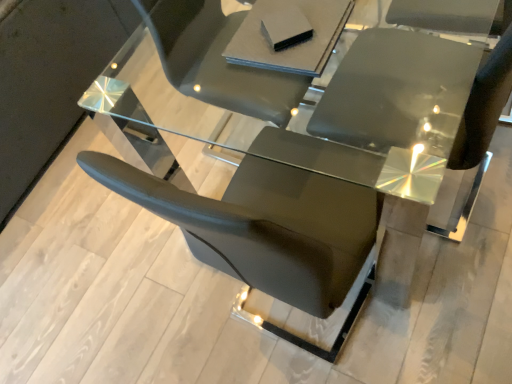
In order to click on vacant area on top of matte gray book at upper center, placed as the 1th table when sorted from back to front (from a real-world perspective) in this screenshot , I will do `click(286, 18)`.